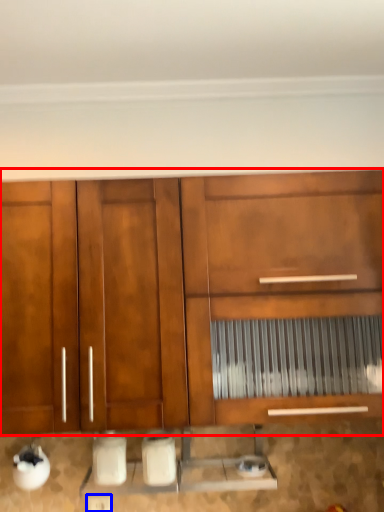
Question: Which object is further to the camera taking this photo, cabinetry (highlighted by a red box) or electric outlet (highlighted by a blue box)?

Choices:
 (A) cabinetry
 (B) electric outlet

Answer: (B)